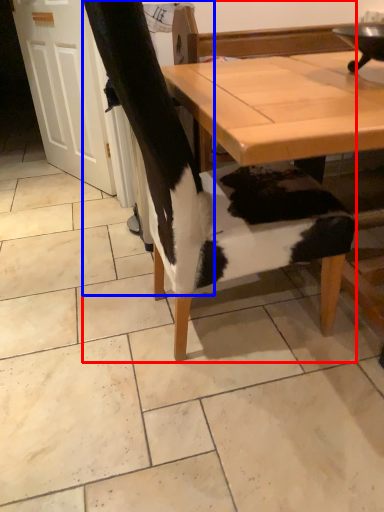
Question: Among these objects, which one is nearest to the camera, chair (highlighted by a red box) or leg (highlighted by a blue box)?

Choices:
 (A) chair
 (B) leg

Answer: (A)